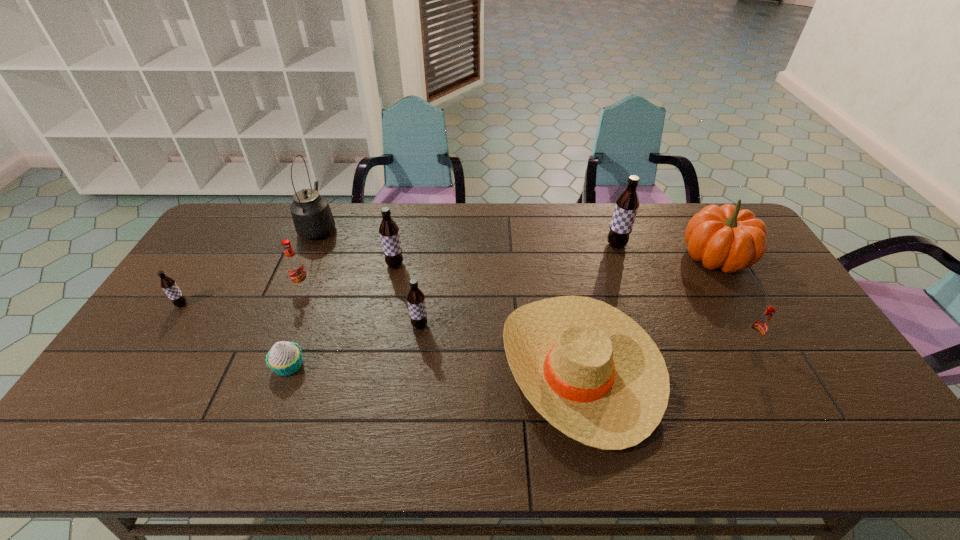
In order to click on object at the left edge in this screenshot , I will do `click(169, 285)`.

The width and height of the screenshot is (960, 540). I want to click on object located in the right edge section of the desktop, so click(x=727, y=237).

Locate an element on the screen. The image size is (960, 540). object located in the far right corner section of the desktop is located at coordinates (727, 237).

In the image, there is a desktop. Where is `blank space at the far edge`? This screenshot has width=960, height=540. blank space at the far edge is located at coordinates (373, 232).

Find the location of a particular element. vacant space at the near edge of the desktop is located at coordinates (528, 430).

In the image, there is a desktop. Identify the location of vacant area at the left edge. (173, 355).

In the image, there is a desktop. At what (x,y) coordinates should I click in order to perform the action: click on free space at the right edge. Please return your answer as a coordinate pair (x, y). The image size is (960, 540). Looking at the image, I should click on (771, 349).

At what (x,y) coordinates should I click in order to perform the action: click on free space at the far left corner of the desktop. Please return your answer as a coordinate pair (x, y). The height and width of the screenshot is (540, 960). Looking at the image, I should click on (237, 242).

This screenshot has width=960, height=540. I want to click on free space between the sunhat and the second smallest brown root beer, so click(499, 347).

Image resolution: width=960 pixels, height=540 pixels. What are the coordinates of `free spot between the fourth farthest root beer and the second farthest brown root beer` in the screenshot? It's located at (288, 285).